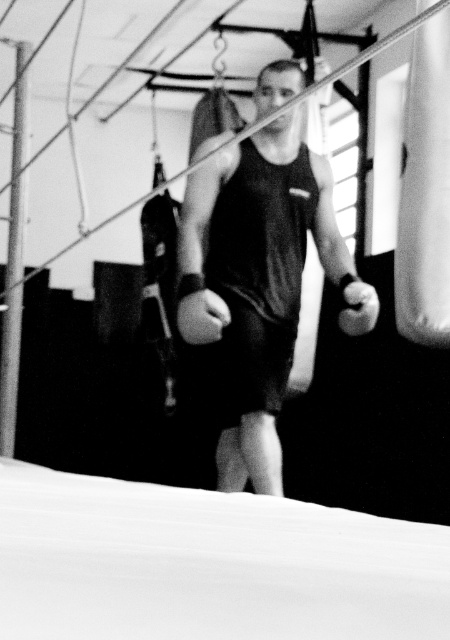
In the scene shown: You are a personal trainer observing a client in a gym. The client is wearing a black matte tank top at center and has a black matte boxing glove at center. Based on their positions, can you determine which item is closer to the ceiling?

The black matte tank top at center is above the black matte boxing glove at center, so the tank top is closer to the ceiling.

You are a fitness instructor observing a client in a gym. The client is wearing a black matte tank top at center and has a black matte boxing glove at center. Based on the scene, can you determine if the tank top is wider than the boxing glove?

The black matte tank top at center might be wider than black matte boxing glove at center according to the description.

You are a personal trainer observing a client in a gym. You notice the black matte tank top at center and the black matte boxing glove at center. Which piece of clothing or equipment is positioned more to the left side of the image?

The black matte tank top at center is positioned to the left of the black matte boxing glove at center, so the tank top is more to the left side of the image.